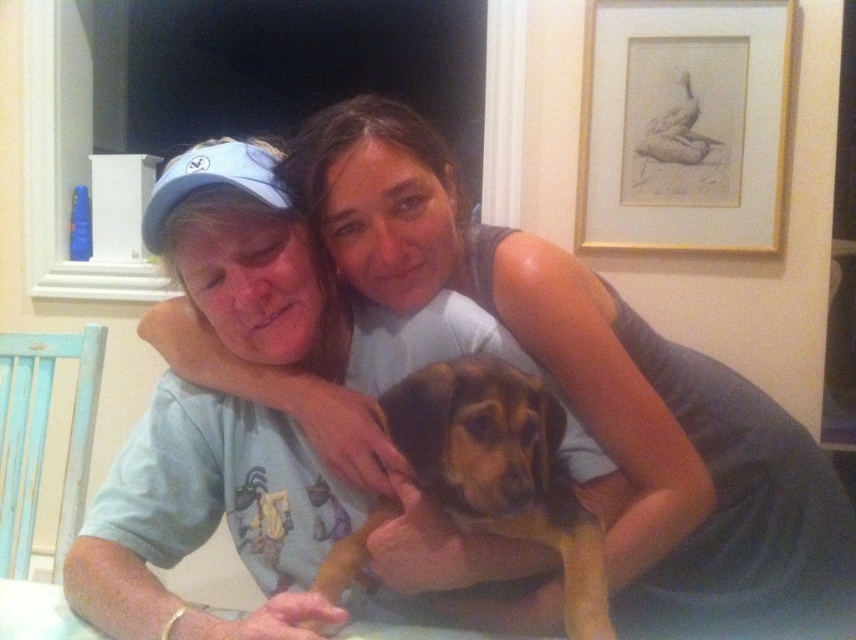
Can you confirm if matte gray tank top at center is bigger than gold framed drawing at upper right?

Correct, matte gray tank top at center is larger in size than gold framed drawing at upper right.

Is point (758, 580) more distant than point (604, 88)?

No, (758, 580) is closer to viewer.

Is point (635, 595) closer to viewer compared to point (657, 29)?

Yes, point (635, 595) is closer to viewer.

Where is `matte gray tank top at center`? This screenshot has height=640, width=856. matte gray tank top at center is located at coordinates (592, 378).

Who is more forward, (x=271, y=397) or (x=550, y=438)?

Point (x=550, y=438)

Where is `matte gray tank top at center`? This screenshot has height=640, width=856. matte gray tank top at center is located at coordinates (592, 378).

Does point (752, 576) lie in front of point (500, 509)?

That is False.

The image size is (856, 640). I want to click on matte gray tank top at center, so click(592, 378).

Is gold framed drawing at upper right to the left of brown fur dog at center from the viewer's perspective?

No, gold framed drawing at upper right is not to the left of brown fur dog at center.

Is gold framed drawing at upper right smaller than brown fur dog at center?

No, gold framed drawing at upper right is not smaller than brown fur dog at center.

Measure the distance between point (681, 83) and camera.

They are 1.86 meters apart.

Locate an element on the screen. The image size is (856, 640). gold framed drawing at upper right is located at coordinates (682, 124).